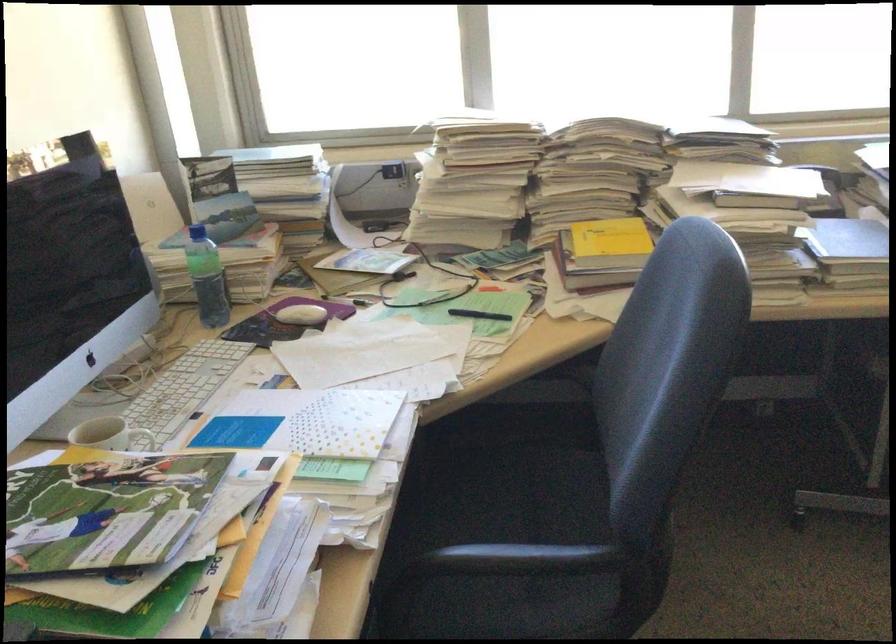
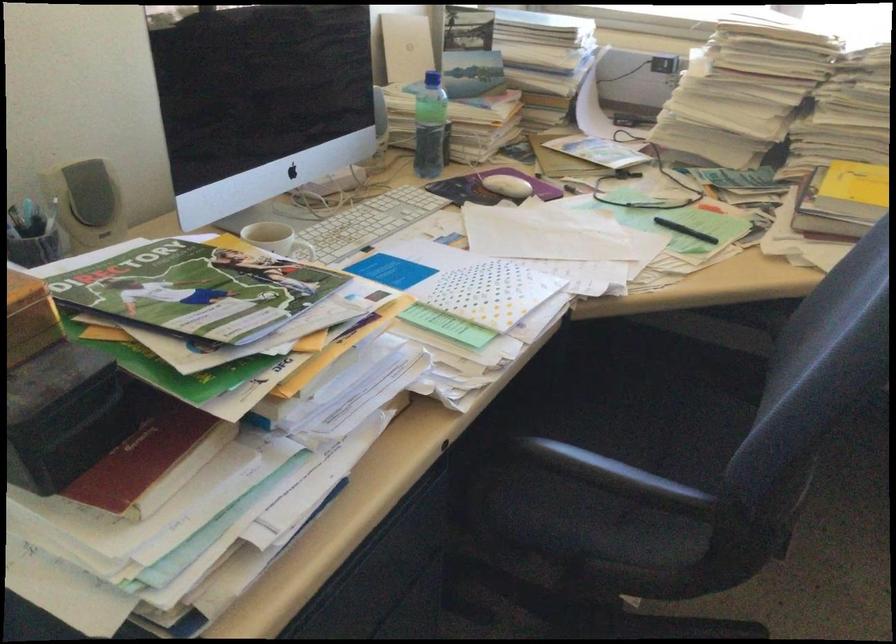
Find the pixel in the second image that matches (604,248) in the first image.

(853, 194)